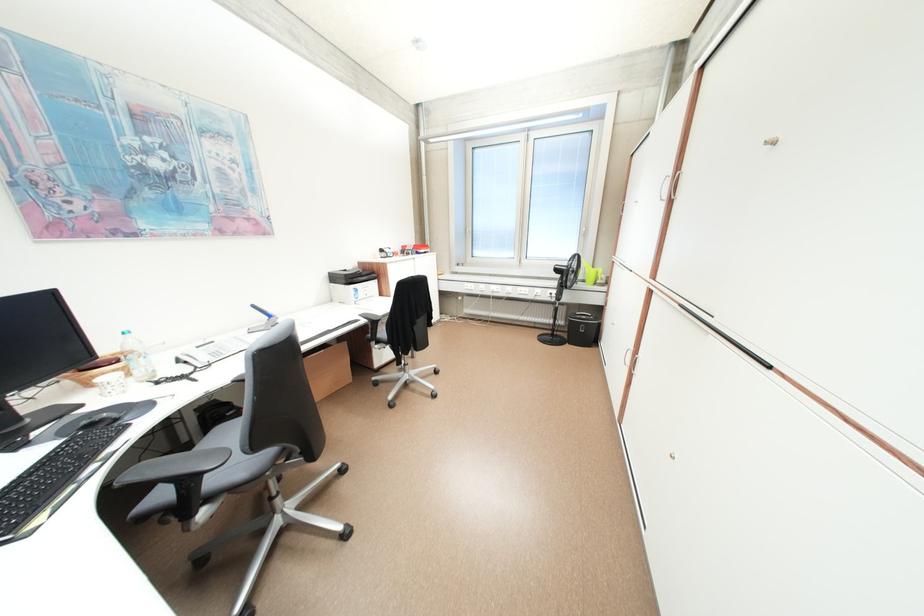
At what (x,y) coordinates should I click in order to perform the action: click on telephone handset. Please return your answer as a coordinate pair (x, y). The height and width of the screenshot is (616, 924). Looking at the image, I should click on (210, 352).